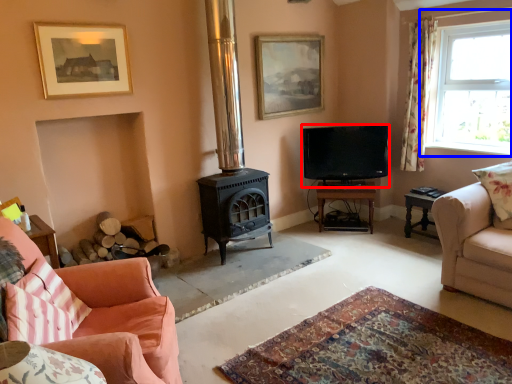
Question: Which point is further to the camera, television (highlighted by a red box) or window (highlighted by a blue box)?

Choices:
 (A) television
 (B) window

Answer: (A)